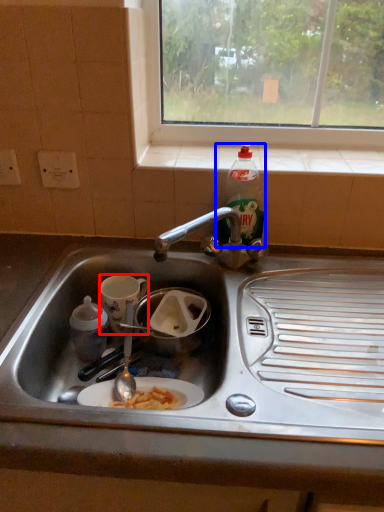
Question: Which point is closer to the camera, coffee cup (highlighted by a red box) or bottle (highlighted by a blue box)?

Choices:
 (A) coffee cup
 (B) bottle

Answer: (B)